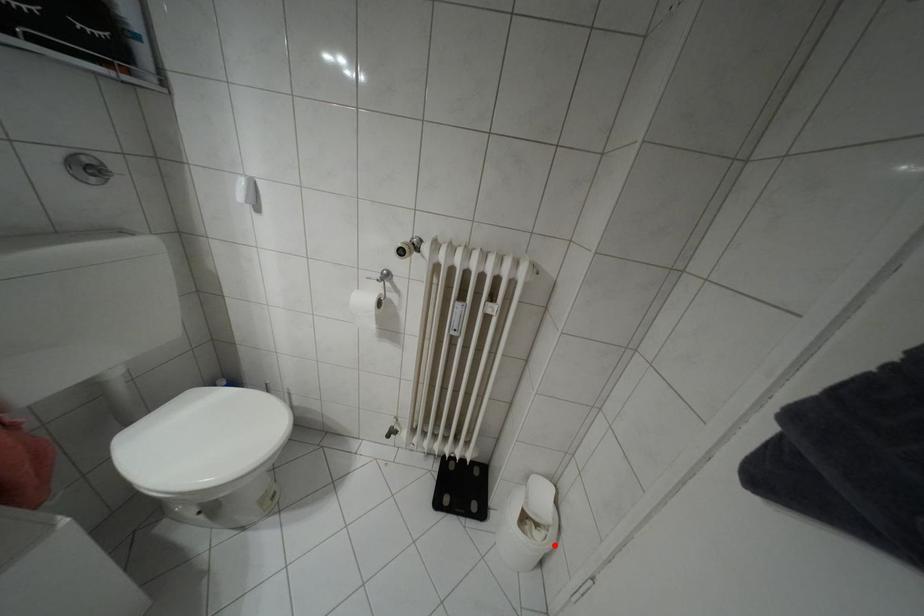
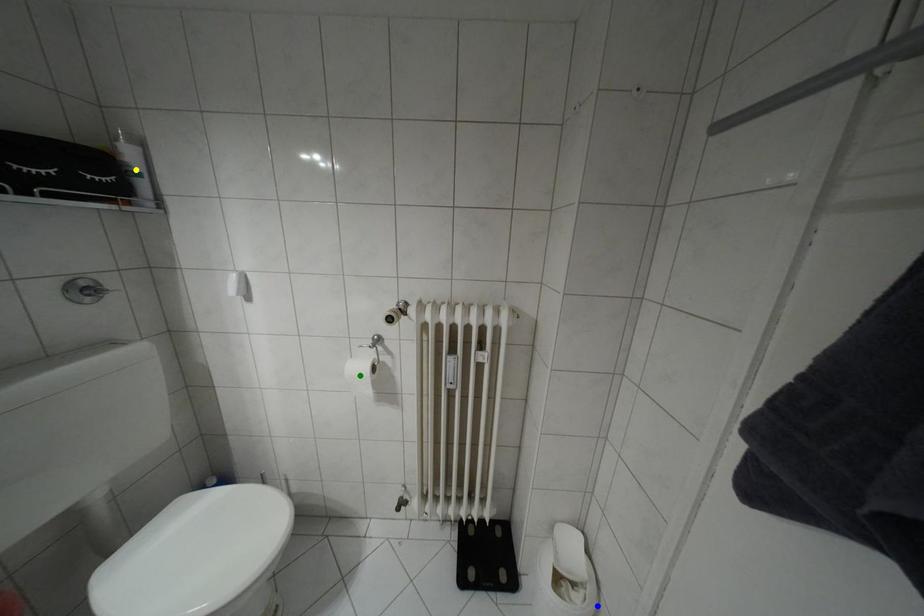
Question: I am providing you with two images of the same scene from different viewpoints. A red point is marked on the first image. You are given multiple points on the second image. In image 2, which mark is for the same physical point as the one in image 1?

Choices:
 (A) green point
 (B) blue point
 (C) yellow point

Answer: (B)